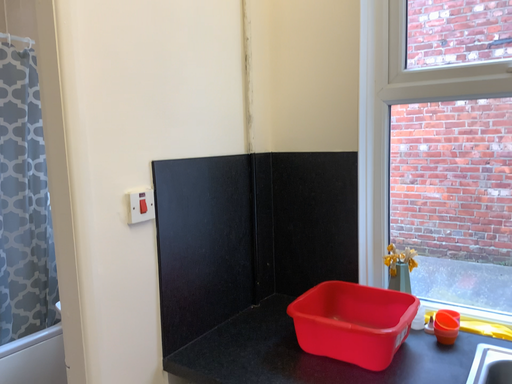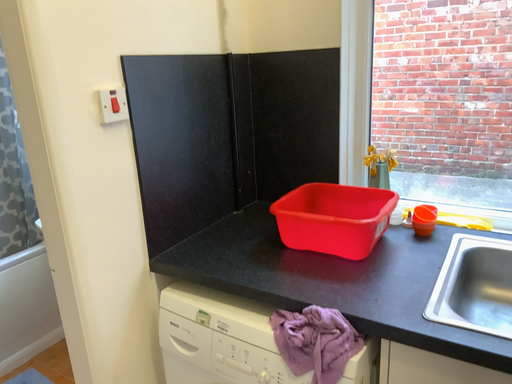
Question: Which way did the camera rotate in the video?

Choices:
 (A) rotated upward
 (B) rotated downward

Answer: (B)